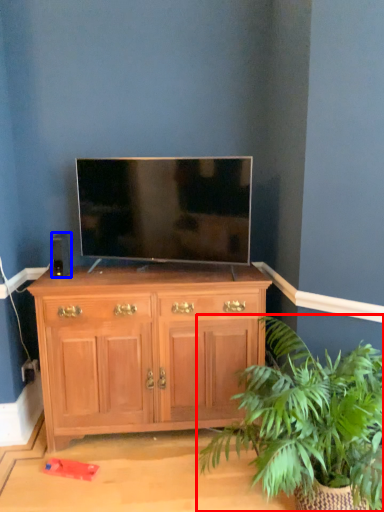
Question: Which point is closer to the camera, houseplant (highlighted by a red box) or speaker (highlighted by a blue box)?

Choices:
 (A) houseplant
 (B) speaker

Answer: (A)